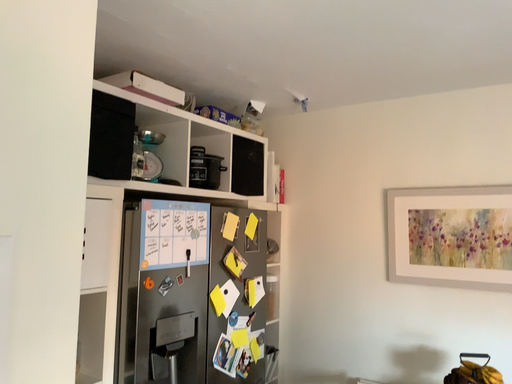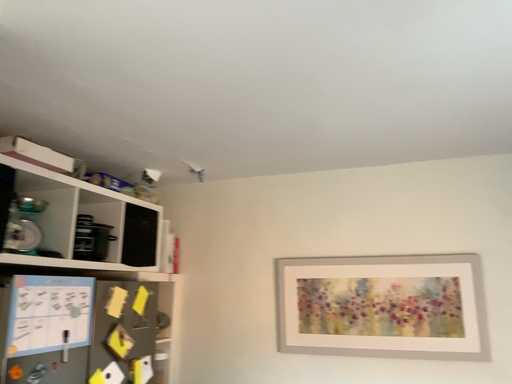
Question: How did the camera likely rotate when shooting the video?

Choices:
 (A) rotated upward
 (B) rotated downward

Answer: (A)